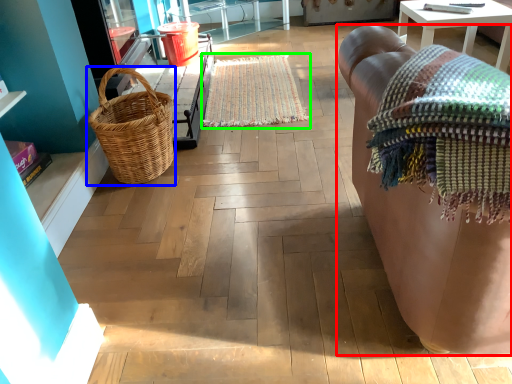
Question: Considering the real-world distances, which object is closest to studio couch (highlighted by a red box)? picnic basket (highlighted by a blue box) or mat (highlighted by a green box).

Choices:
 (A) picnic basket
 (B) mat

Answer: (A)